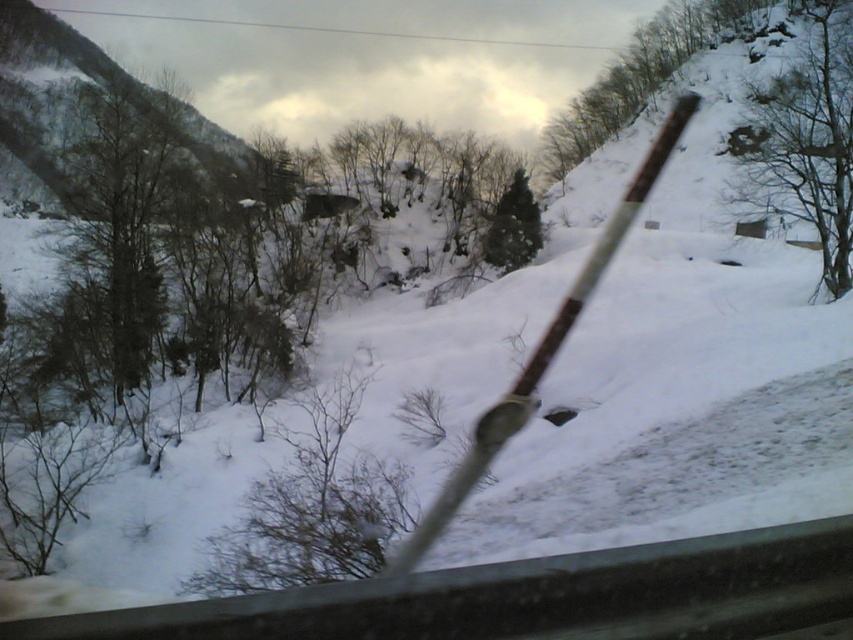
Question: Is green leafy tree at upper center above green matte tree at center?

Choices:
 (A) no
 (B) yes

Answer: (B)

Question: Which of the following is the farthest from the observer?

Choices:
 (A) (670, 68)
 (B) (506, 268)

Answer: (A)

Question: Estimate the real-world distances between objects in this image. Which object is closer to the green leafy tree at upper center?

Choices:
 (A) green matte tree at center
 (B) brown textured bush at center
 (C) brown textured tree at upper right

Answer: (C)

Question: Which object appears farthest from the camera in this image?

Choices:
 (A) green matte tree at center
 (B) brown textured tree at upper right
 (C) green leafy tree at upper center

Answer: (C)

Question: Can you confirm if green leafy tree at upper center is smaller than green matte tree at center?

Choices:
 (A) yes
 (B) no

Answer: (B)

Question: Is green leafy tree at upper center positioned before green matte tree at center?

Choices:
 (A) yes
 (B) no

Answer: (B)